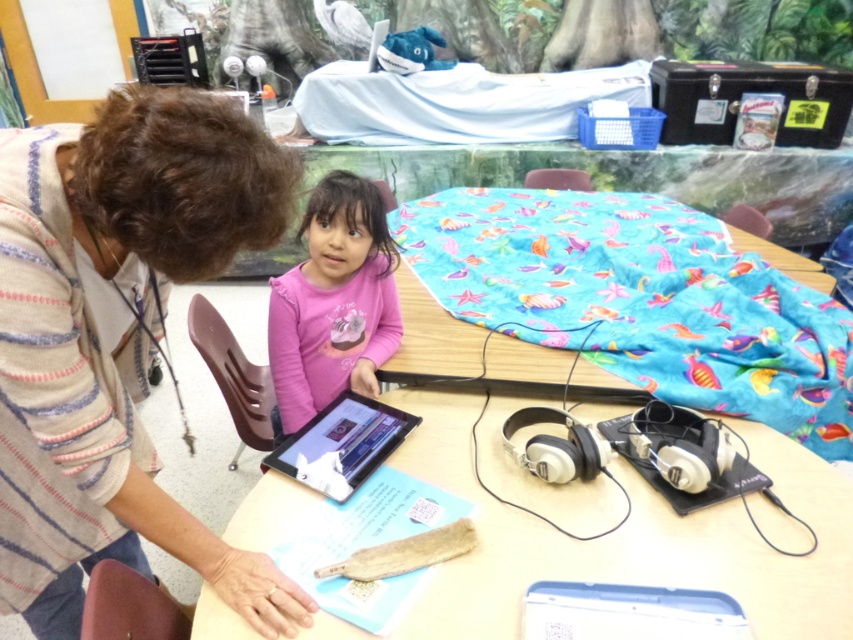
Can you confirm if striped sweater at upper left is positioned below pink matte shirt at center?

Yes.

This screenshot has height=640, width=853. What do you see at coordinates (117, 339) in the screenshot?
I see `striped sweater at upper left` at bounding box center [117, 339].

Locate an element on the screen. The image size is (853, 640). striped sweater at upper left is located at coordinates (117, 339).

Image resolution: width=853 pixels, height=640 pixels. Describe the element at coordinates (630, 538) in the screenshot. I see `smooth beige table at center` at that location.

Does smooth beige table at center have a smaller size compared to pink matte shirt at center?

No.

Locate an element on the screen. This screenshot has height=640, width=853. smooth beige table at center is located at coordinates (630, 538).

Does striped sweater at upper left have a lesser width compared to smooth beige table at center?

Yes, striped sweater at upper left is thinner than smooth beige table at center.

Measure the distance from striped sweater at upper left to smooth beige table at center.

The distance of striped sweater at upper left from smooth beige table at center is 18.97 inches.

Between point (59, 262) and point (613, 524), which one is positioned in front?

Positioned in front is point (59, 262).

Identify the location of striped sweater at upper left. (117, 339).